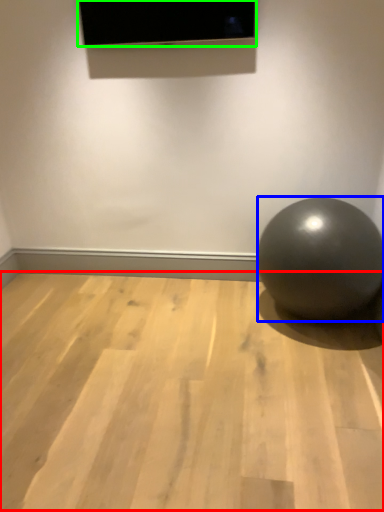
Question: Which object is positioned farthest from surface (highlighted by a red box)? Select from ball (highlighted by a blue box) and projection screen (highlighted by a green box).

Choices:
 (A) ball
 (B) projection screen

Answer: (B)